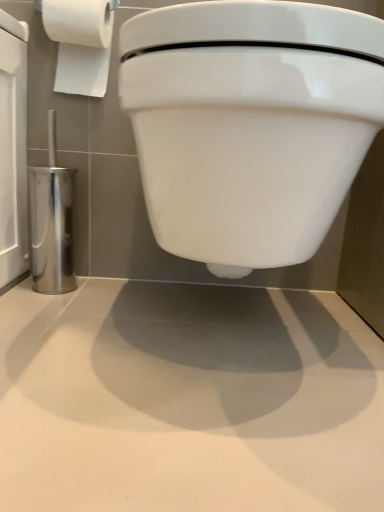
Question: From a real-world perspective, is white glossy toilet at center below white paper at upper left?

Choices:
 (A) yes
 (B) no

Answer: (A)

Question: Is white glossy toilet at center to the left of white paper at upper left from the viewer's perspective?

Choices:
 (A) yes
 (B) no

Answer: (B)

Question: Can we say white glossy toilet at center lies outside white paper at upper left?

Choices:
 (A) no
 (B) yes

Answer: (B)

Question: Is white glossy toilet at center oriented towards white paper at upper left?

Choices:
 (A) yes
 (B) no

Answer: (B)

Question: Is white glossy toilet at center turned away from white paper at upper left?

Choices:
 (A) yes
 (B) no

Answer: (B)

Question: Is white paper at upper left a part of white glossy toilet at center?

Choices:
 (A) no
 (B) yes

Answer: (A)

Question: Is white paper at upper left at the left side of white glossy toilet at center?

Choices:
 (A) yes
 (B) no

Answer: (A)

Question: Is white paper at upper left positioned in front of white glossy toilet at center?

Choices:
 (A) yes
 (B) no

Answer: (B)

Question: Considering the relative sizes of white paper at upper left and white glossy toilet at center in the image provided, is white paper at upper left smaller than white glossy toilet at center?

Choices:
 (A) no
 (B) yes

Answer: (B)

Question: From the image's perspective, is white paper at upper left located above white glossy toilet at center?

Choices:
 (A) no
 (B) yes

Answer: (B)

Question: Is white paper at upper left to the right of white glossy toilet at center from the viewer's perspective?

Choices:
 (A) no
 (B) yes

Answer: (A)

Question: Is white paper at upper left outside white glossy toilet at center?

Choices:
 (A) no
 (B) yes

Answer: (B)

Question: Considering the positions of point (56, 77) and point (314, 118), is point (56, 77) closer or farther from the camera than point (314, 118)?

Choices:
 (A) closer
 (B) farther

Answer: (B)